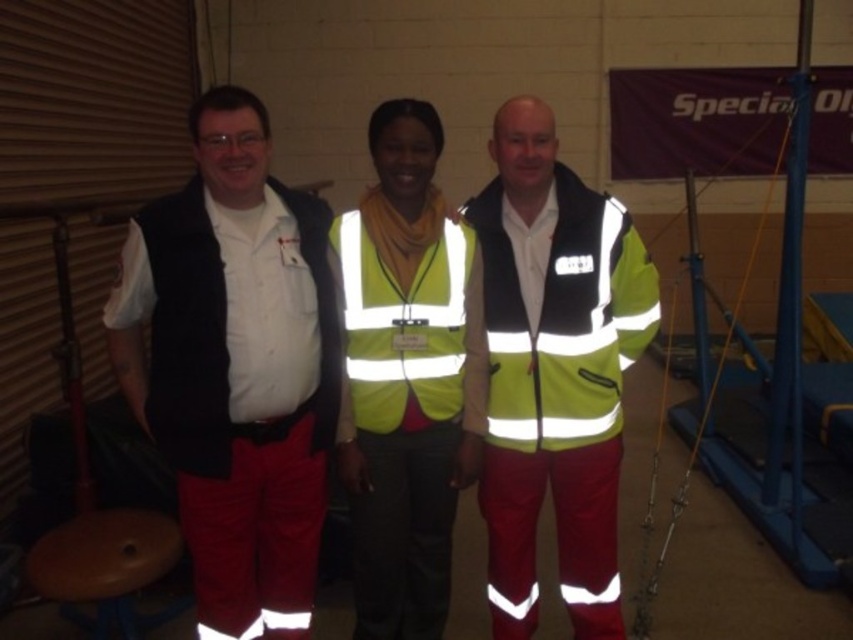
You are standing at the origin point in the image and want to reach the point labeled point (543, 356). However, there is an obstacle at point (200, 268). Can you go straight to your destination without moving around the obstacle?

Since point (200, 268) is in front of point (543, 356), you cannot go straight to point (543, 356) without moving around the obstacle at point (200, 268).